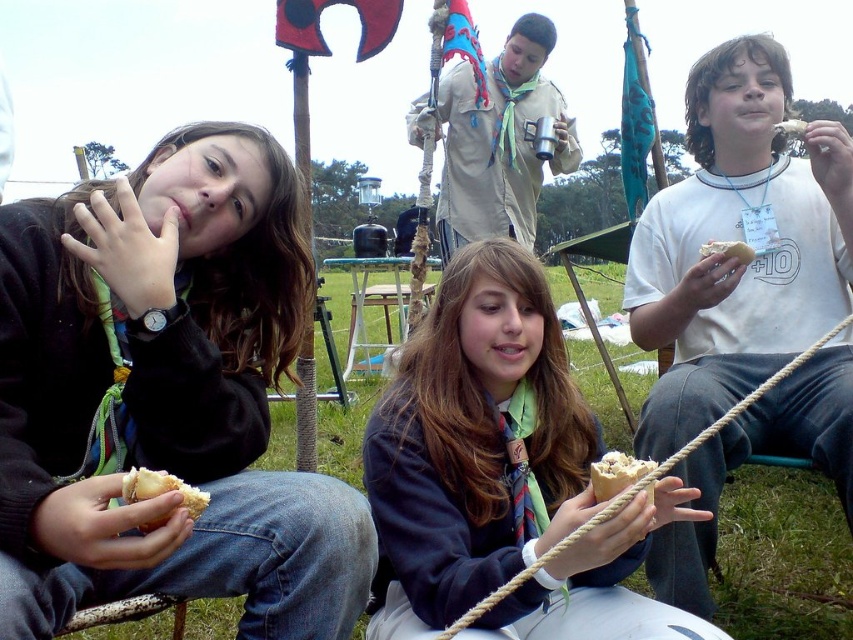
You are a photographer trying to capture a closeup of the white bread at lower center and the white bread at upper center. Which one will appear larger in your photo?

The white bread at lower center will appear larger in the photo because it is closer to the viewer than the white bread at upper center.

You are a photographer trying to capture a closeup of the white bread at lower center and the white bread at upper center. Which one is positioned lower in the image?

The white bread at lower center is positioned lower in the image than the white bread at upper center.